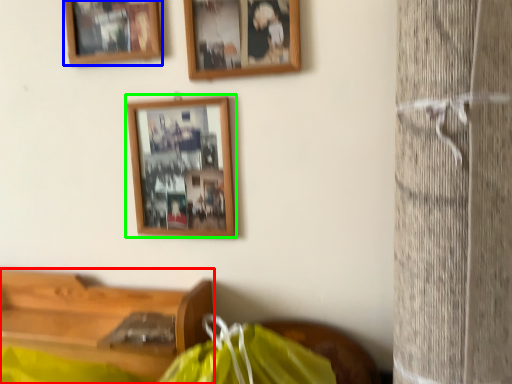
Question: Which object is positioned farthest from furniture (highlighted by a red box)? Select from picture frame (highlighted by a blue box) and picture frame (highlighted by a green box).

Choices:
 (A) picture frame
 (B) picture frame

Answer: (A)